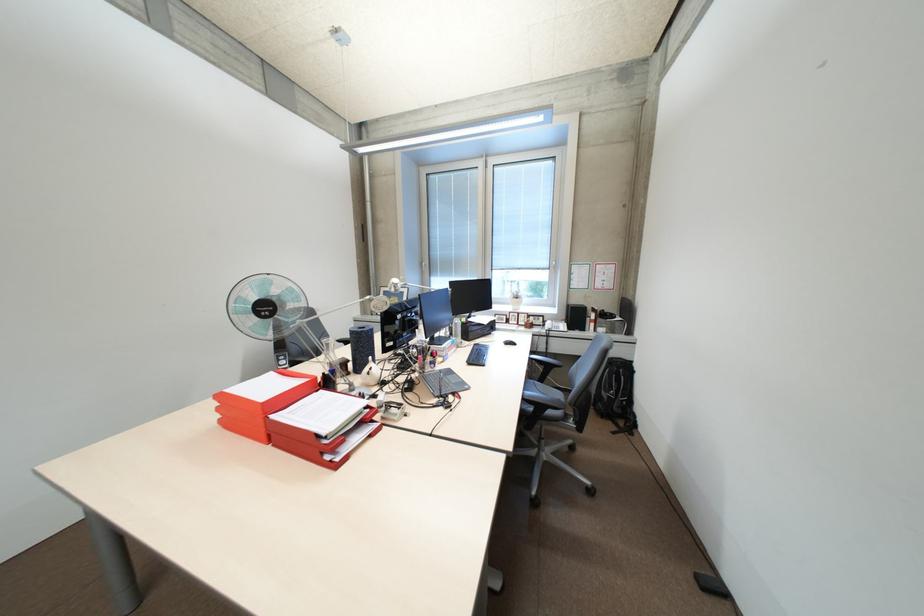
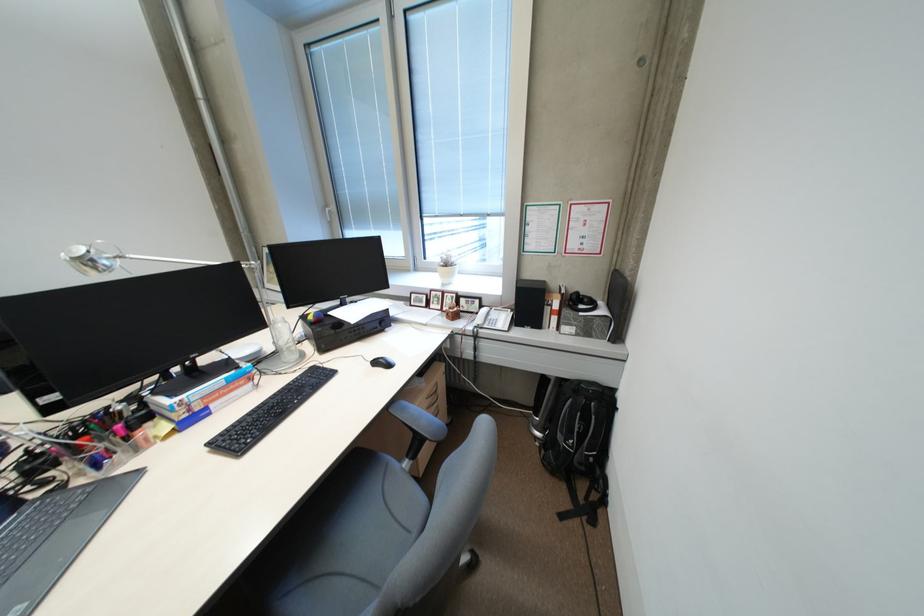
Find the pixel in the second image that matches (407,283) in the first image.

(90, 257)